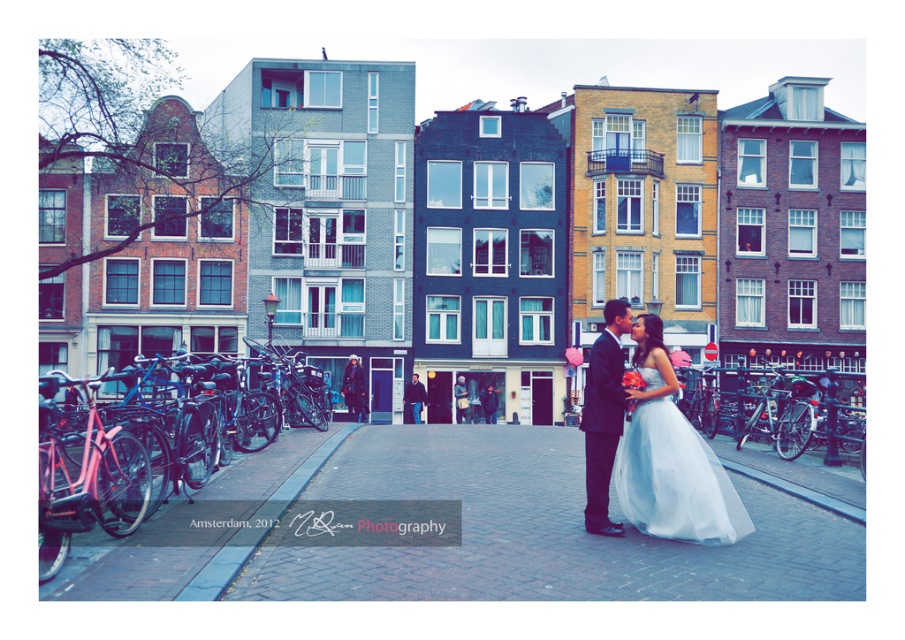
Question: From the image, what is the correct spatial relationship of white tulle dress at center in relation to white satin dress at center?

Choices:
 (A) right
 (B) left

Answer: (A)

Question: Does white tulle dress at center come behind white satin dress at center?

Choices:
 (A) no
 (B) yes

Answer: (A)

Question: Which point appears farthest from the camera in this image?

Choices:
 (A) pyautogui.click(x=595, y=515)
 (B) pyautogui.click(x=708, y=448)

Answer: (B)

Question: Is white tulle dress at center above white satin dress at center?

Choices:
 (A) no
 (B) yes

Answer: (B)